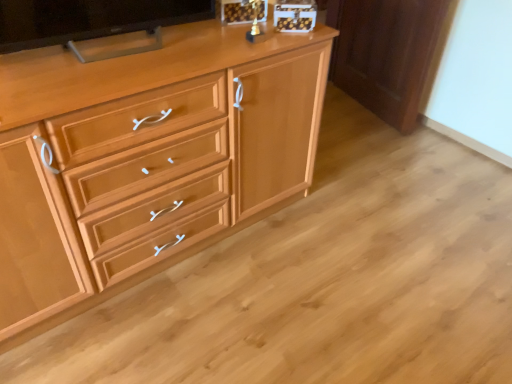
Question: Is point (369, 9) closer or farther from the camera than point (240, 56)?

Choices:
 (A) farther
 (B) closer

Answer: (A)

Question: Looking at their shapes, would you say light brown wood cabinet at right is wider or thinner than light wood cabinet at center?

Choices:
 (A) thin
 (B) wide

Answer: (A)

Question: Which is farther from the matte black tv at upper left?

Choices:
 (A) light wood cabinet at center
 (B) light brown wood cabinet at right

Answer: (B)

Question: Estimate the real-world distances between objects in this image. Which object is farther from the light brown wood cabinet at right?

Choices:
 (A) light wood cabinet at center
 (B) matte black tv at upper left

Answer: (B)